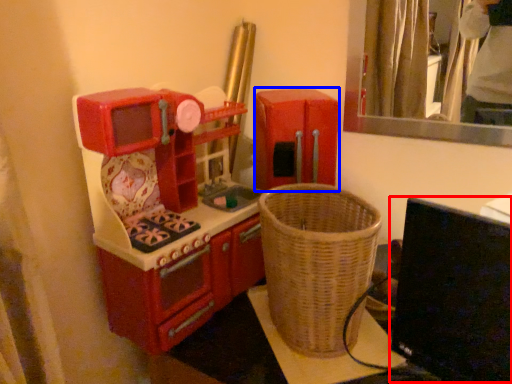
Question: Among these objects, which one is farthest to the camera, computer monitor (highlighted by a red box) or appliance (highlighted by a blue box)?

Choices:
 (A) computer monitor
 (B) appliance

Answer: (B)